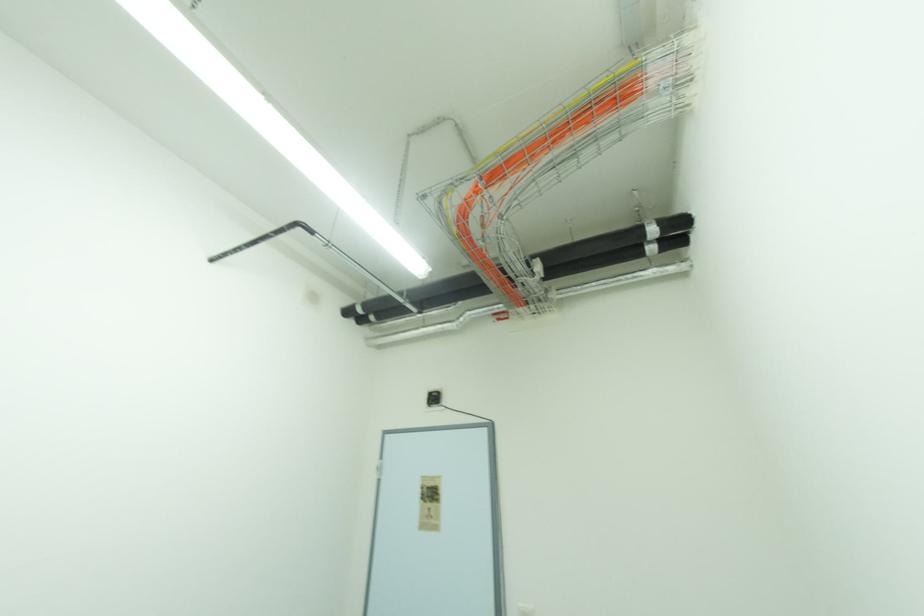
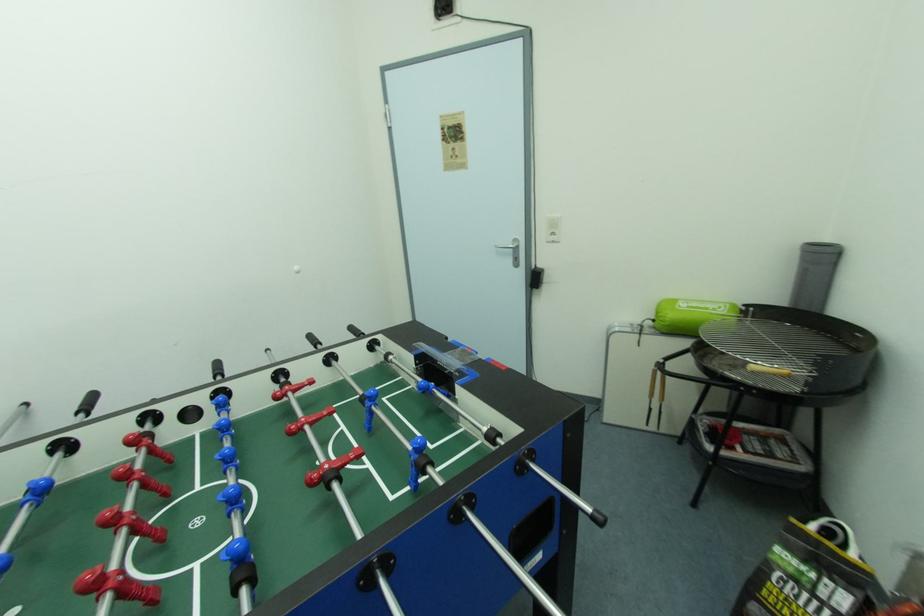
Question: How did the camera likely rotate?

Choices:
 (A) Left
 (B) Right
 (C) Up
 (D) Down

Answer: (D)